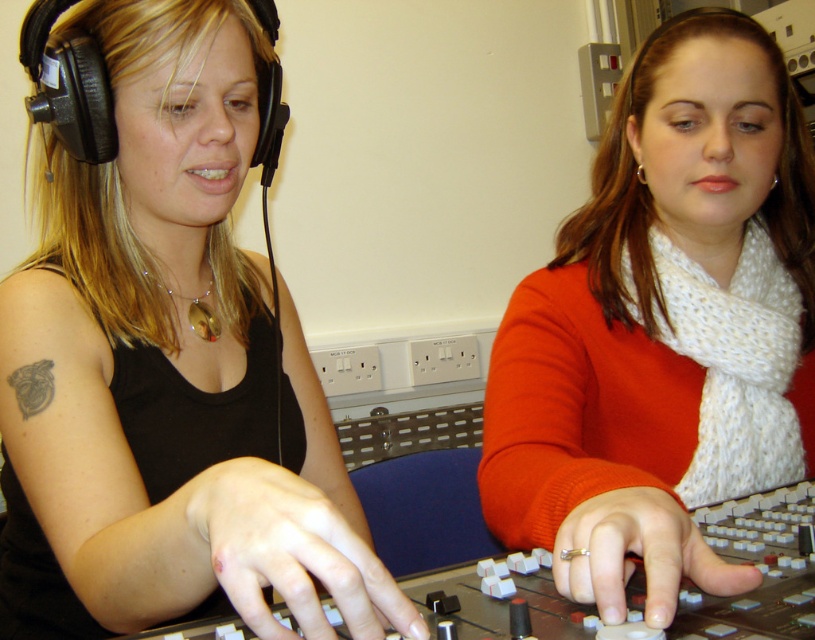
Question: Does matte black headphones at left lie in front of white knitted scarf at center?

Choices:
 (A) no
 (B) yes

Answer: (B)

Question: Where is matte black headphones at left located in relation to white knitted scarf at center in the image?

Choices:
 (A) above
 (B) below

Answer: (B)

Question: Does matte black headphones at left have a larger size compared to white knitted scarf at center?

Choices:
 (A) no
 (B) yes

Answer: (B)

Question: Which point is farther to the camera?

Choices:
 (A) matte black headphones at left
 (B) white knitted scarf at center

Answer: (B)

Question: Which point is closer to the camera?

Choices:
 (A) matte black headphones at left
 (B) white knitted scarf at center

Answer: (A)